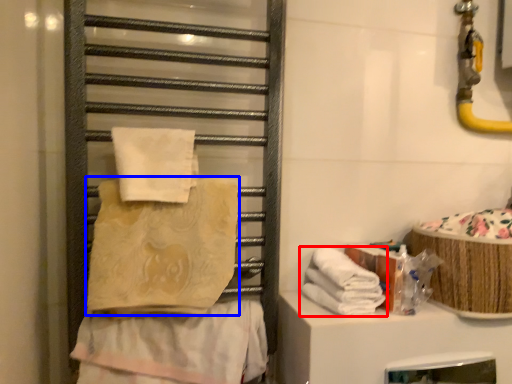
Question: Which object appears closest to the camera in this image, towel (highlighted by a red box) or towel (highlighted by a blue box)?

Choices:
 (A) towel
 (B) towel

Answer: (B)